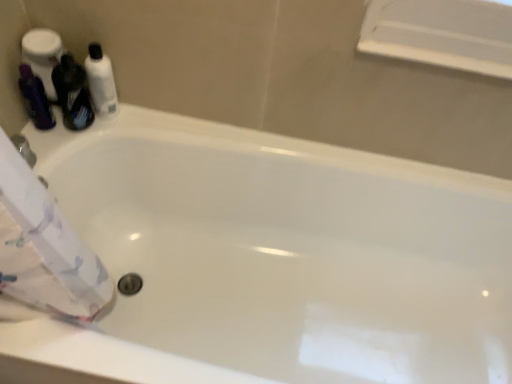
Question: Is matte purple shampoo at left, which is the 1th toiletry in left-to-right order, further to the viewer compared to white glossy bottle at upper left, which is the 2th toiletry from left to right?

Choices:
 (A) no
 (B) yes

Answer: (A)

Question: Is matte purple shampoo at left, which is the 1th toiletry in left-to-right order, oriented away from white glossy bottle at upper left, positioned as the first toiletry in right-to-left order?

Choices:
 (A) yes
 (B) no

Answer: (B)

Question: Considering the relative positions of matte purple shampoo at left, which is the 1th toiletry in left-to-right order, and white glossy bottle at upper left, positioned as the first toiletry in right-to-left order, in the image provided, is matte purple shampoo at left, which is the 1th toiletry in left-to-right order, to the left of white glossy bottle at upper left, positioned as the first toiletry in right-to-left order, from the viewer's perspective?

Choices:
 (A) no
 (B) yes

Answer: (B)

Question: Can white glossy bottle at upper left, which is the 2th toiletry from left to right, be found inside matte purple shampoo at left, which is the 1th toiletry in left-to-right order?

Choices:
 (A) no
 (B) yes

Answer: (A)

Question: From the image's perspective, would you say matte purple shampoo at left, which is the 1th toiletry in left-to-right order, is shown under white glossy bottle at upper left, positioned as the first toiletry in right-to-left order?

Choices:
 (A) yes
 (B) no

Answer: (A)

Question: From a real-world perspective, is matte purple shampoo at left, which is the 1th toiletry in left-to-right order, over white glossy bottle at upper left, positioned as the first toiletry in right-to-left order?

Choices:
 (A) yes
 (B) no

Answer: (B)

Question: Considering the relative sizes of matte black bottle at left and matte purple shampoo at left, which is the 1th toiletry in left-to-right order, in the image provided, is matte black bottle at left thinner than matte purple shampoo at left, which is the 1th toiletry in left-to-right order,?

Choices:
 (A) yes
 (B) no

Answer: (B)

Question: Is matte black bottle at left further to the viewer compared to matte purple shampoo at left, which appears as the second toiletry when viewed from the right?

Choices:
 (A) yes
 (B) no

Answer: (B)

Question: Is matte black bottle at left surrounding matte purple shampoo at left, which is the 1th toiletry in left-to-right order?

Choices:
 (A) yes
 (B) no

Answer: (B)

Question: From a real-world perspective, is matte black bottle at left under matte purple shampoo at left, which is the 1th toiletry in left-to-right order?

Choices:
 (A) no
 (B) yes

Answer: (A)

Question: Is matte black bottle at left located outside matte purple shampoo at left, which is the 1th toiletry in left-to-right order?

Choices:
 (A) no
 (B) yes

Answer: (B)

Question: Does matte black bottle at left have a lesser height compared to matte purple shampoo at left, which is the 1th toiletry in left-to-right order?

Choices:
 (A) yes
 (B) no

Answer: (B)

Question: Considering the relative sizes of white glossy bottle at upper left, which is the 2th toiletry from left to right, and matte purple shampoo at left, which is the 1th toiletry in left-to-right order, in the image provided, is white glossy bottle at upper left, which is the 2th toiletry from left to right, smaller than matte purple shampoo at left, which is the 1th toiletry in left-to-right order,?

Choices:
 (A) yes
 (B) no

Answer: (B)